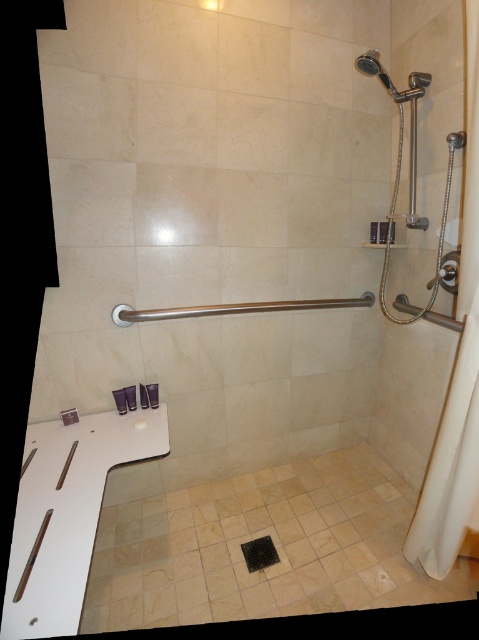
Question: Which of the following is the farthest from the observer?

Choices:
 (A) (380, 72)
 (B) (472, 154)
 (C) (241, 308)

Answer: (C)

Question: Observing the image, what is the correct spatial positioning of white fabric shower curtain at right in reference to satin nickel towel bar at center?

Choices:
 (A) right
 (B) left

Answer: (A)

Question: Can you confirm if satin nickel towel bar at center is positioned to the left of matte silver showerhead at upper right?

Choices:
 (A) yes
 (B) no

Answer: (A)

Question: Does satin nickel towel bar at center have a lesser width compared to matte silver showerhead at upper right?

Choices:
 (A) yes
 (B) no

Answer: (B)

Question: Which object is farther from the camera taking this photo?

Choices:
 (A) satin nickel towel bar at center
 (B) white fabric shower curtain at right

Answer: (A)

Question: Which is farther from the matte silver showerhead at upper right?

Choices:
 (A) white fabric shower curtain at right
 (B) satin nickel towel bar at center

Answer: (B)